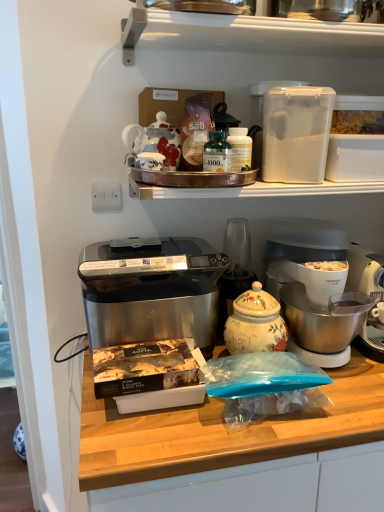
Question: From the image's perspective, is porcelain teapot at upper center, marked as the second appliance in a right-to-left arrangement, on top of satin black toaster oven at center?

Choices:
 (A) yes
 (B) no

Answer: (A)

Question: Is porcelain teapot at upper center, arranged as the 1th appliance when viewed from the left, shorter than satin black toaster oven at center?

Choices:
 (A) yes
 (B) no

Answer: (A)

Question: From the image's perspective, does porcelain teapot at upper center, arranged as the 1th appliance when viewed from the left, appear lower than satin black toaster oven at center?

Choices:
 (A) yes
 (B) no

Answer: (B)

Question: Can you confirm if porcelain teapot at upper center, arranged as the 1th appliance when viewed from the left, is smaller than satin black toaster oven at center?

Choices:
 (A) no
 (B) yes

Answer: (B)

Question: Are porcelain teapot at upper center, arranged as the 1th appliance when viewed from the left, and satin black toaster oven at center making contact?

Choices:
 (A) yes
 (B) no

Answer: (B)

Question: Choose the correct answer: Is satin black toaster oven at center inside white plastic container at upper center or outside it?

Choices:
 (A) outside
 (B) inside

Answer: (A)

Question: From the image's perspective, is satin black toaster oven at center positioned above or below white plastic container at upper center?

Choices:
 (A) above
 (B) below

Answer: (B)

Question: In terms of width, does satin black toaster oven at center look wider or thinner when compared to white plastic container at upper center?

Choices:
 (A) wide
 (B) thin

Answer: (B)

Question: Based on their positions, is satin black toaster oven at center located to the left or right of white plastic container at upper center?

Choices:
 (A) left
 (B) right

Answer: (A)

Question: Which is correct: white plastic coffee maker at lower right is inside decorative ceramic jar at center, or outside of it?

Choices:
 (A) inside
 (B) outside

Answer: (B)

Question: Based on their sizes in the image, would you say white plastic coffee maker at lower right is bigger or smaller than decorative ceramic jar at center?

Choices:
 (A) big
 (B) small

Answer: (A)

Question: From a real-world perspective, is white plastic coffee maker at lower right physically located above or below decorative ceramic jar at center?

Choices:
 (A) above
 (B) below

Answer: (A)

Question: From the image's perspective, is white plastic coffee maker at lower right above or below decorative ceramic jar at center?

Choices:
 (A) above
 (B) below

Answer: (A)

Question: Is point (210, 136) closer or farther from the camera than point (301, 443)?

Choices:
 (A) closer
 (B) farther

Answer: (B)

Question: In terms of width, does green glass bottle at center look wider or thinner when compared to stainless steel appliance at center?

Choices:
 (A) thin
 (B) wide

Answer: (A)